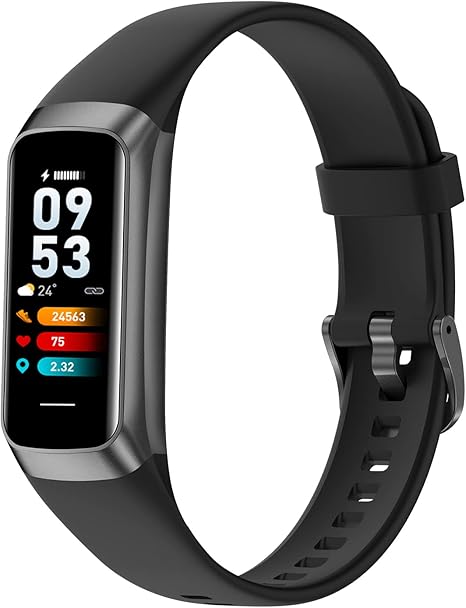
Identify the location of screen. This screenshot has width=466, height=608. (63, 356).